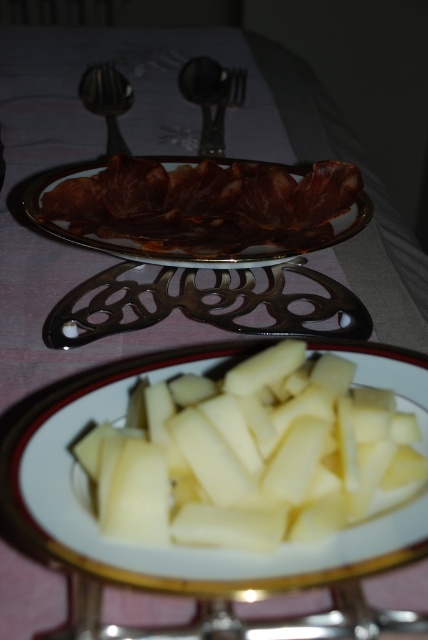
Question: Which object is positioned closest to the white glossy plate at center?

Choices:
 (A) shiny silver spoon at upper left
 (B) polished metal spoon at upper center

Answer: (B)

Question: Observing the image, what is the correct spatial positioning of matte brown plate at center in reference to polished metal spoon at upper center?

Choices:
 (A) below
 (B) above

Answer: (A)

Question: Which object appears closest to the camera in this image?

Choices:
 (A) shiny silver spoon at upper left
 (B) matte brown plate at center
 (C) white glossy plate at center
 (D) polished metal spoon at upper center

Answer: (C)

Question: Can you confirm if white glossy plate at center is positioned to the right of polished metal spoon at upper center?

Choices:
 (A) yes
 (B) no

Answer: (A)

Question: In this image, where is white glossy plate at center located relative to polished metal spoon at upper center?

Choices:
 (A) above
 (B) below

Answer: (B)

Question: Which point is farther to the camera?

Choices:
 (A) polished metal spoon at upper center
 (B) matte brown plate at center
 (C) shiny silver spoon at upper left

Answer: (C)